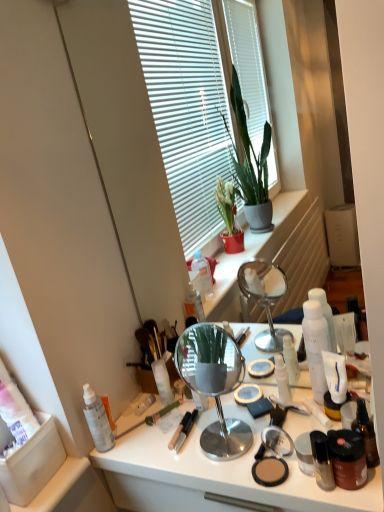
Find the location of a particular element. The image size is (384, 512). vacant space that is in between polished silver mirror at center and transparent plastic spray bottle at left, the 7th toiletry in the right-to-left sequence is located at coordinates point(157,444).